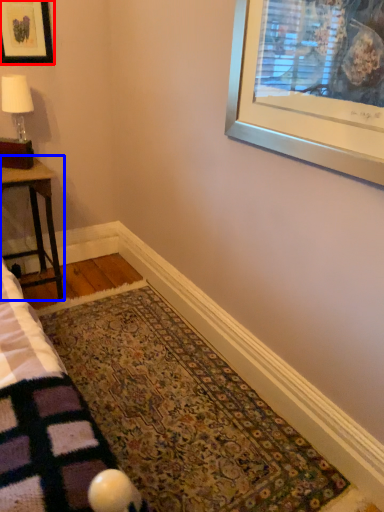
Question: Which point is closer to the camera, picture frame (highlighted by a red box) or table (highlighted by a blue box)?

Choices:
 (A) picture frame
 (B) table

Answer: (B)